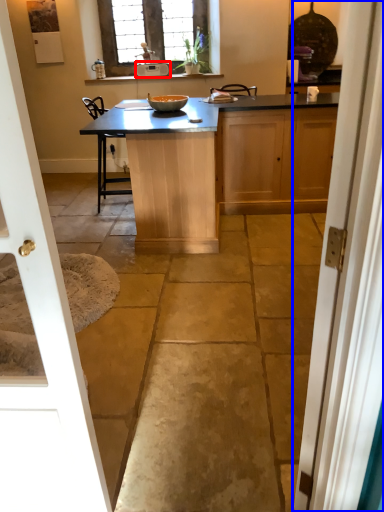
Question: Among these objects, which one is nearest to the camera, appliance (highlighted by a red box) or door (highlighted by a blue box)?

Choices:
 (A) appliance
 (B) door

Answer: (B)